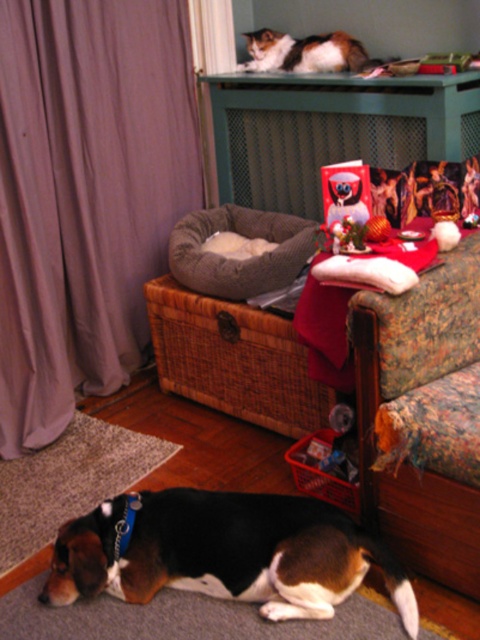
In the scene, there is a purple fabric curtain at left and a matte plastic toy at center. Which object is bigger in size?

The purple fabric curtain at left is larger in size compared to the matte plastic toy at center.

You are a small cat trying to jump onto the gray plush dog bed at center from the couch. The cat can jump up to 2 meters. Can the cat reach the bed?

The gray plush dog bed at center is 2.37 meters away from the viewer, so the cat cannot reach it since its maximum jump distance is 2 meters.